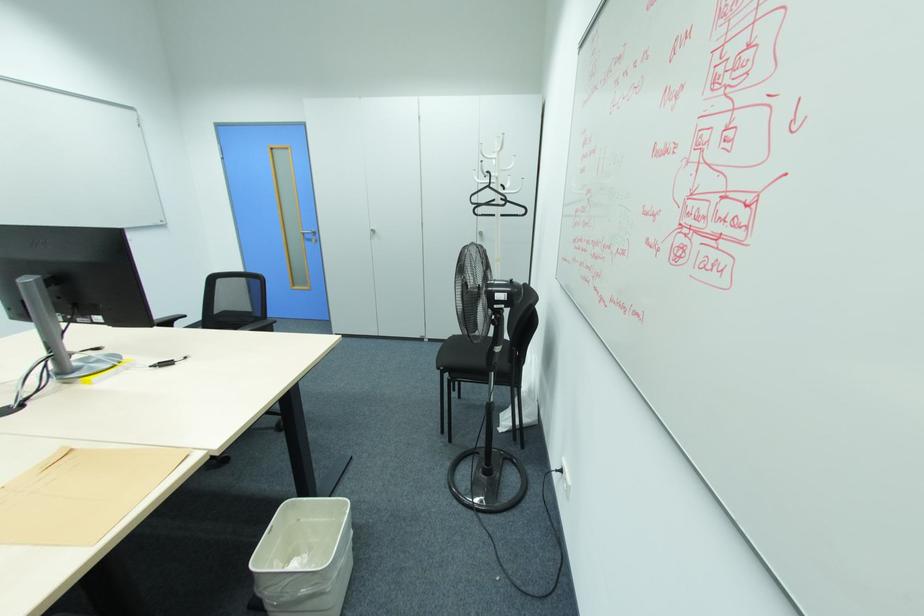
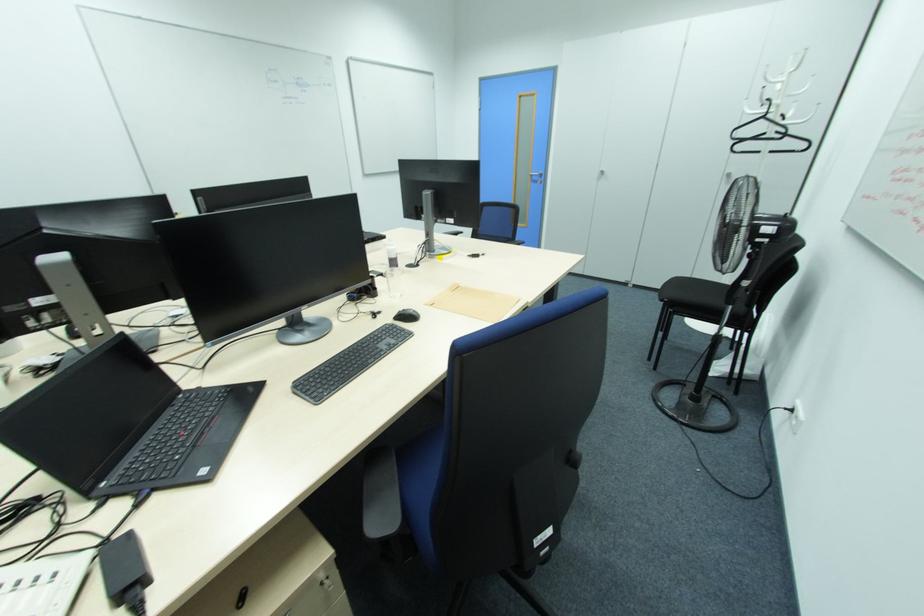
Question: How did the camera likely rotate?

Choices:
 (A) Left
 (B) Right
 (C) Up
 (D) Down

Answer: (A)